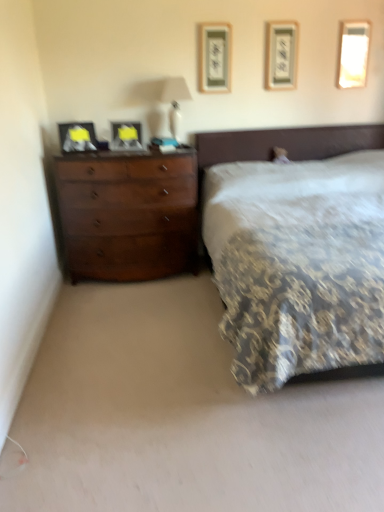
Question: Are matte black picture frame at center, positioned as the fourth picture frame in right-to-left order, and dark wood dresser at left beside each other?

Choices:
 (A) no
 (B) yes

Answer: (A)

Question: Does matte black picture frame at center, positioned as the fourth picture frame in right-to-left order, turn towards dark wood dresser at left?

Choices:
 (A) no
 (B) yes

Answer: (A)

Question: Does matte black picture frame at center, positioned as the fourth picture frame in right-to-left order, come behind dark wood dresser at left?

Choices:
 (A) no
 (B) yes

Answer: (B)

Question: From a real-world perspective, is matte black picture frame at center, positioned as the fourth picture frame in right-to-left order, under dark wood dresser at left?

Choices:
 (A) yes
 (B) no

Answer: (B)

Question: Is dark wood dresser at left completely or partially inside matte black picture frame at center, marked as the second picture frame in a left-to-right arrangement?

Choices:
 (A) yes
 (B) no

Answer: (B)

Question: Considering the relative positions of matte black picture frame at center, positioned as the fourth picture frame in right-to-left order, and dark wood dresser at left in the image provided, is matte black picture frame at center, positioned as the fourth picture frame in right-to-left order, to the right of dark wood dresser at left from the viewer's perspective?

Choices:
 (A) yes
 (B) no

Answer: (B)

Question: From the image's perspective, is white glossy lampshade at upper center over matte wood picture frame at upper center, acting as the 3th picture frame starting from the right?

Choices:
 (A) no
 (B) yes

Answer: (A)

Question: Is white glossy lampshade at upper center positioned beyond the bounds of matte wood picture frame at upper center, arranged as the third picture frame when viewed from the left?

Choices:
 (A) yes
 (B) no

Answer: (A)

Question: Considering the relative positions of white glossy lampshade at upper center and matte wood picture frame at upper center, arranged as the third picture frame when viewed from the left, in the image provided, is white glossy lampshade at upper center to the left of matte wood picture frame at upper center, arranged as the third picture frame when viewed from the left, from the viewer's perspective?

Choices:
 (A) yes
 (B) no

Answer: (A)

Question: Is white glossy lampshade at upper center touching matte wood picture frame at upper center, arranged as the third picture frame when viewed from the left?

Choices:
 (A) yes
 (B) no

Answer: (B)

Question: Is white glossy lampshade at upper center at the right side of matte wood picture frame at upper center, arranged as the third picture frame when viewed from the left?

Choices:
 (A) yes
 (B) no

Answer: (B)

Question: Does white glossy lampshade at upper center have a greater height compared to matte wood picture frame at upper center, acting as the 3th picture frame starting from the right?

Choices:
 (A) yes
 (B) no

Answer: (A)

Question: Is patterned fabric bed at center shorter than metallic silver picture frame at upper center, the 2th picture frame when ordered from right to left?

Choices:
 (A) yes
 (B) no

Answer: (B)